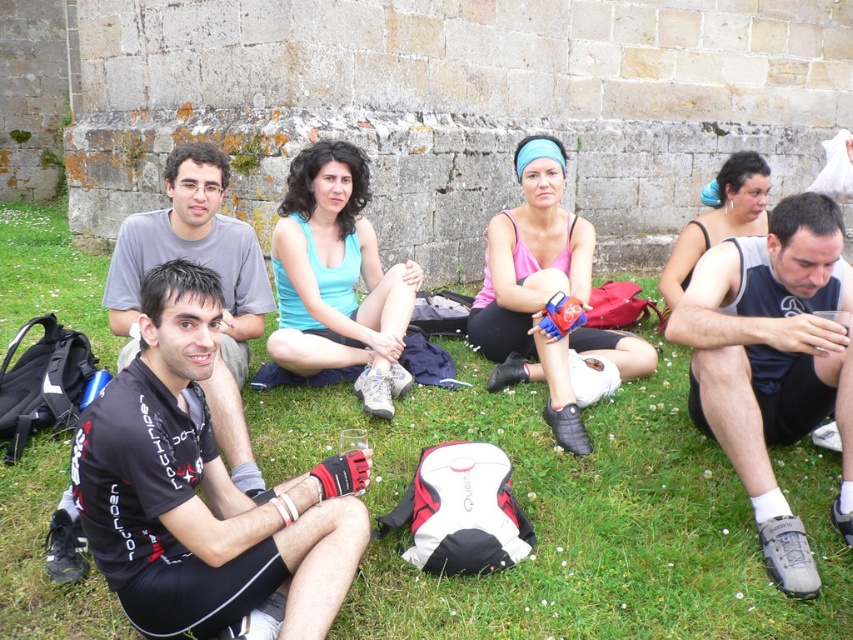
Who is more forward, (705,504) or (190,227)?

Point (705,504)

Who is positioned more to the left, green grass at lower center or black matte shirt at center?

Positioned to the left is black matte shirt at center.

Where is `green grass at lower center`? This screenshot has width=853, height=640. green grass at lower center is located at coordinates pos(573,515).

I want to click on green grass at lower center, so click(573, 515).

Does black jersey at center have a greater width compared to black matte shirt at center?

Yes.

Does black jersey at center come behind black matte shirt at center?

No, black jersey at center is closer to the viewer.

Is point (326, 476) less distant than point (183, 163)?

That is True.

Image resolution: width=853 pixels, height=640 pixels. Identify the location of black jersey at center. (202, 490).

Is point (556, 140) farther from camera compared to point (120, 326)?

That is True.

Is pink matte tank top at center positioned in front of gray matte shirt at left?

No, it is behind gray matte shirt at left.

Where is `pink matte tank top at center`? This screenshot has width=853, height=640. pink matte tank top at center is located at coordinates (544, 292).